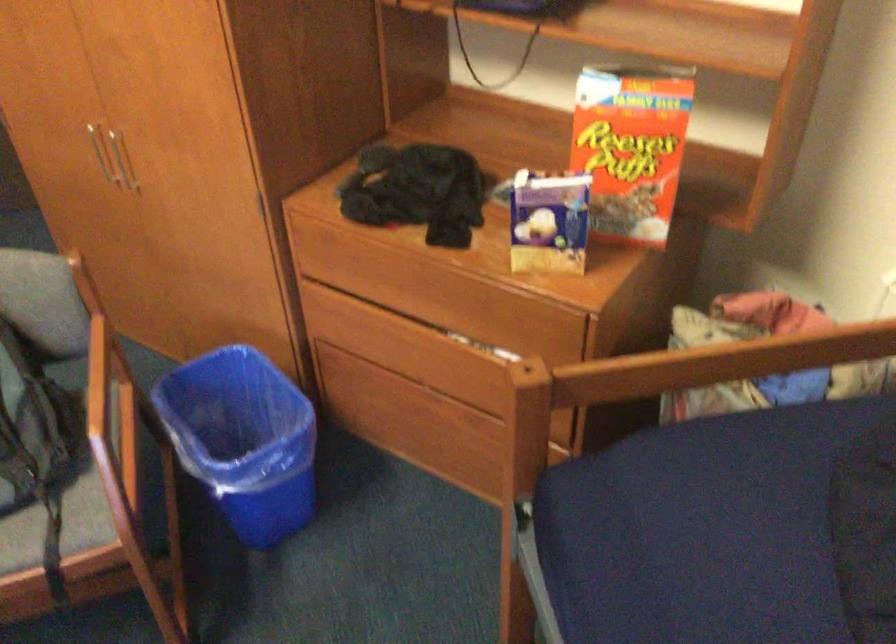
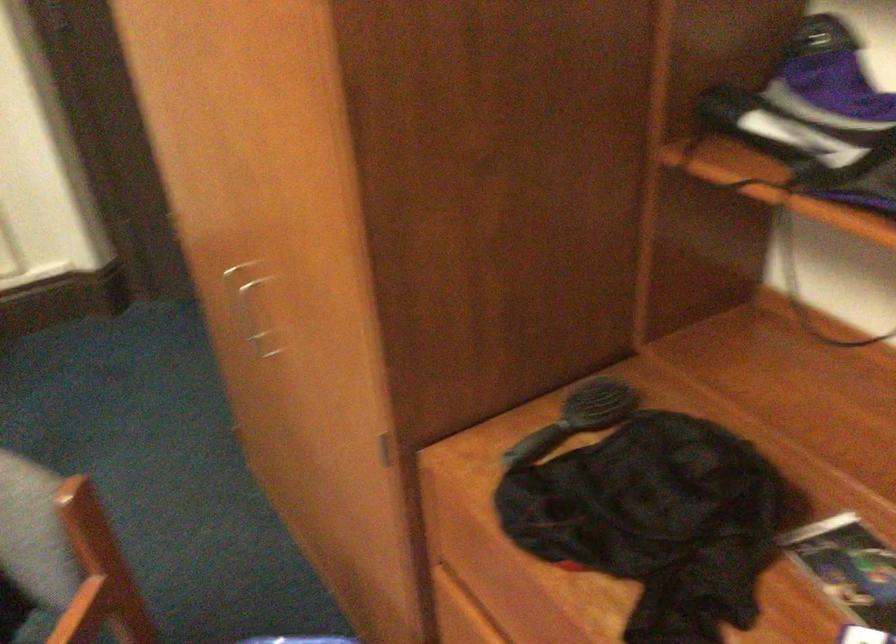
Question: The images are taken continuously from a first-person perspective. In which direction are you moving?

Choices:
 (A) Left
 (B) Right
 (C) Forward
 (D) Backward

Answer: (C)